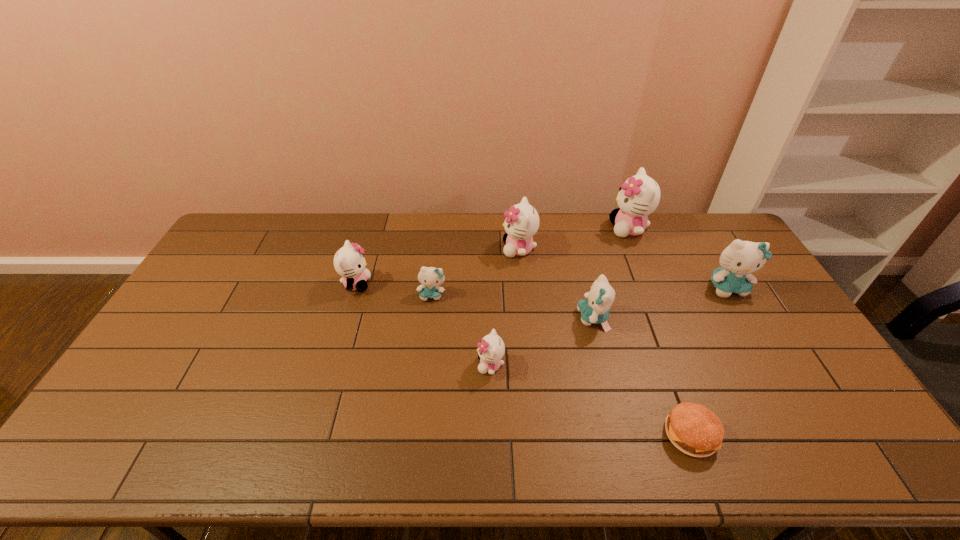
At what (x,y) coordinates should I click in order to perform the action: click on vacant area that satisfies the following two spatial constraints: 1. on the face of the rightmost kitten; 2. on the face of the fifth kitten from left to right. Please return your answer as a coordinate pair (x, y). This screenshot has height=540, width=960. Looking at the image, I should click on (745, 318).

The image size is (960, 540). What are the coordinates of `free space that satisfies the following two spatial constraints: 1. on the face of the shortest object; 2. on the left side of the second object from left to right` in the screenshot? It's located at (417, 434).